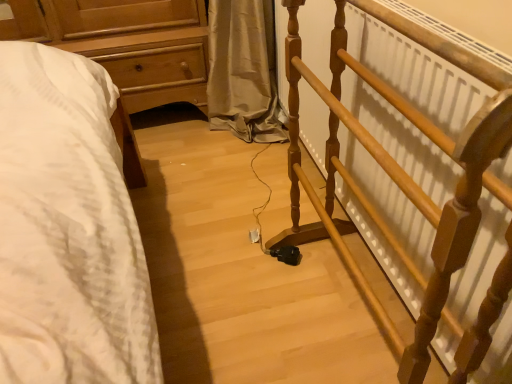
Question: Should I look upward or downward to see wooden spindle rail at right?

Choices:
 (A) up
 (B) down

Answer: (B)